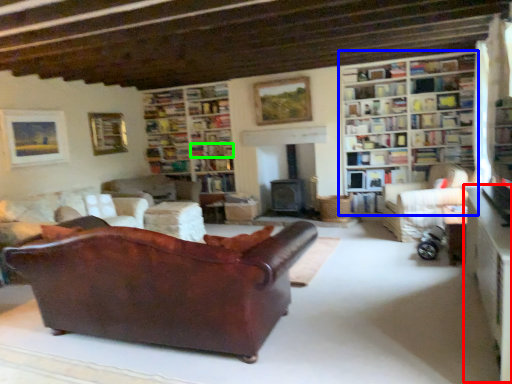
Question: Which object is the closest to the table (highlighted by a red box)? Choose among these: bookcase (highlighted by a blue box) or book (highlighted by a green box).

Choices:
 (A) bookcase
 (B) book

Answer: (A)